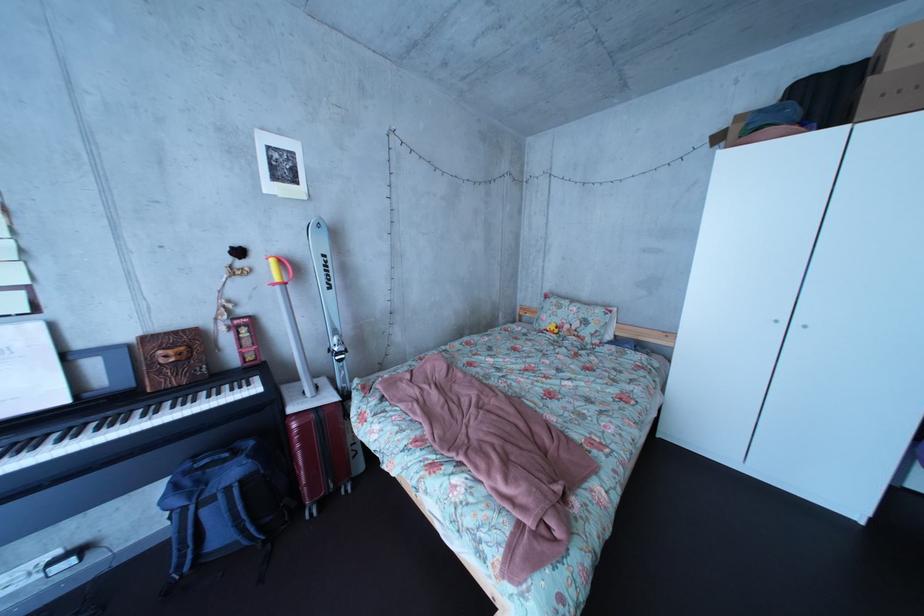
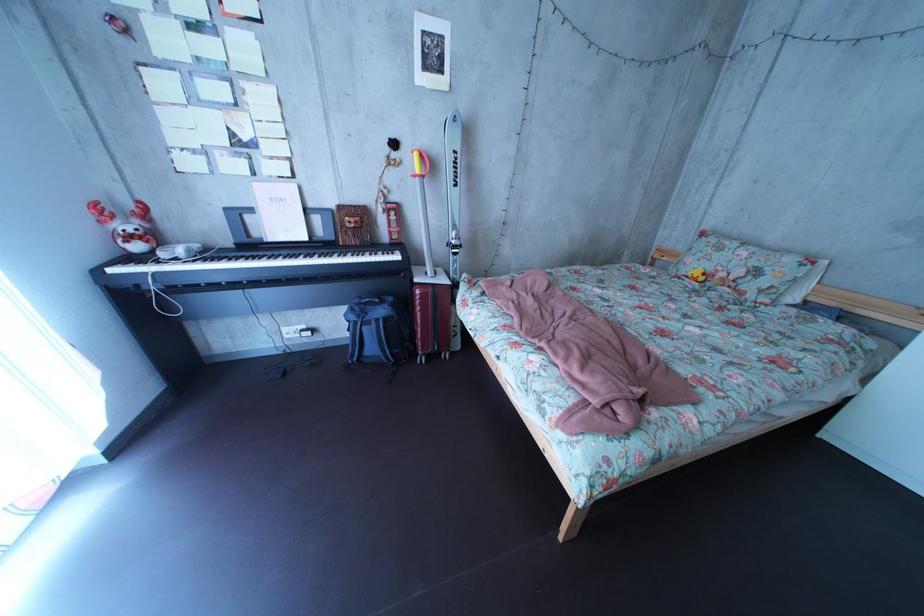
The point at [337,390] is marked in the first image. Where is the corresponding point in the second image?

(455, 278)